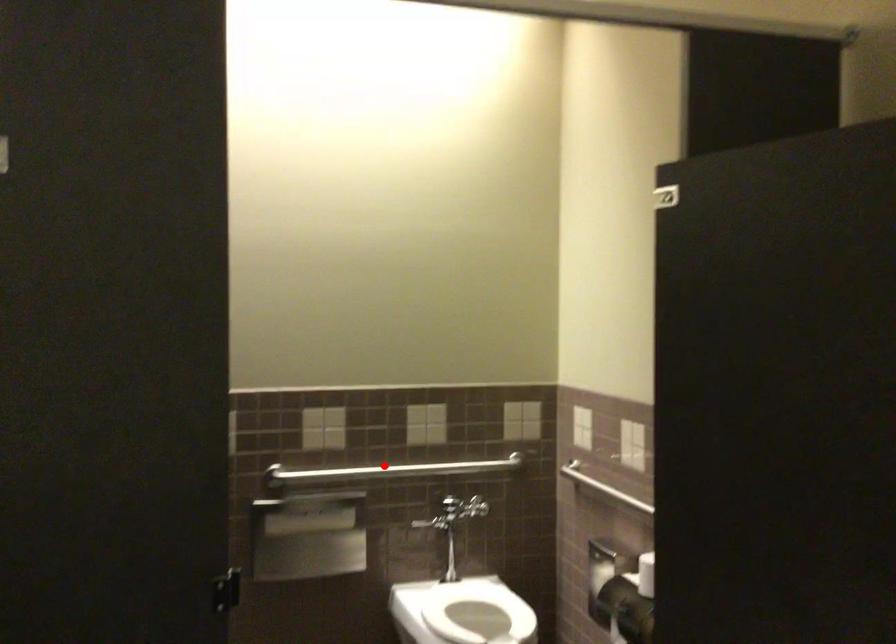
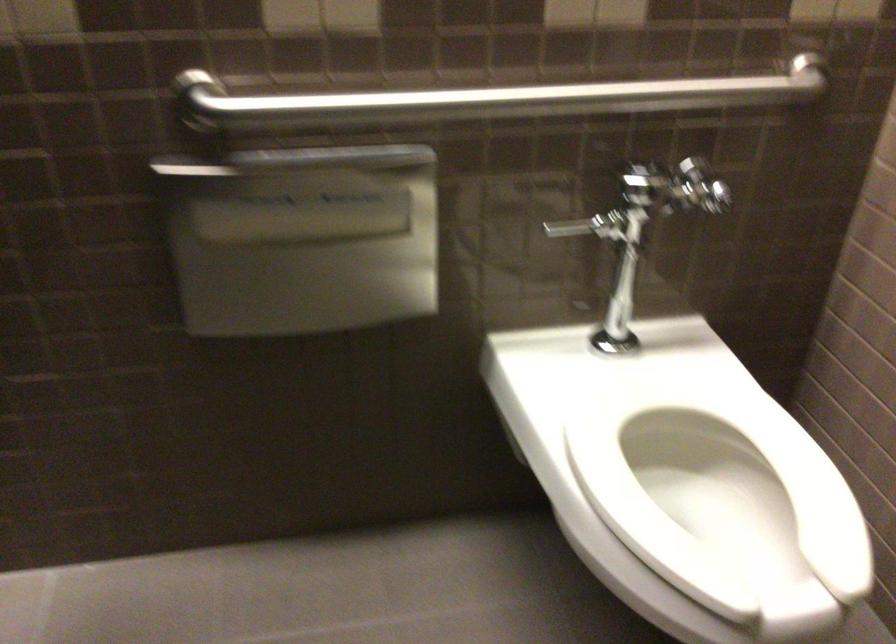
The point at the highlighted location is marked in the first image. Where is the corresponding point in the second image?

(488, 100)